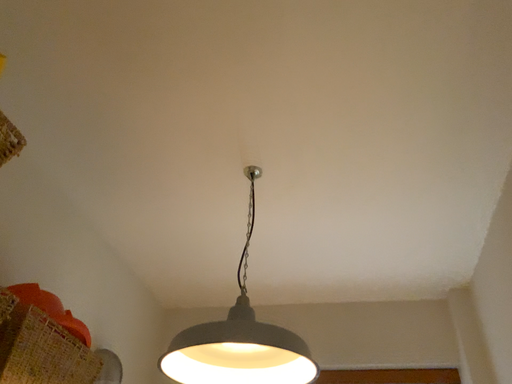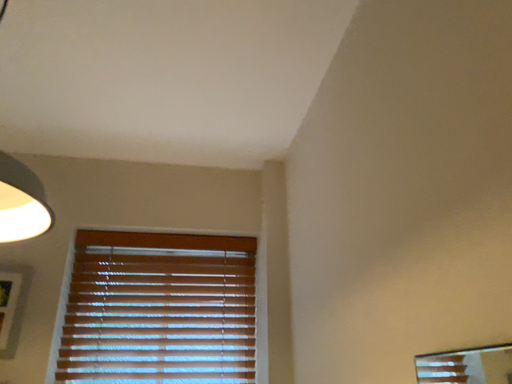
Question: How did the camera likely rotate when shooting the video?

Choices:
 (A) rotated left
 (B) rotated right

Answer: (B)